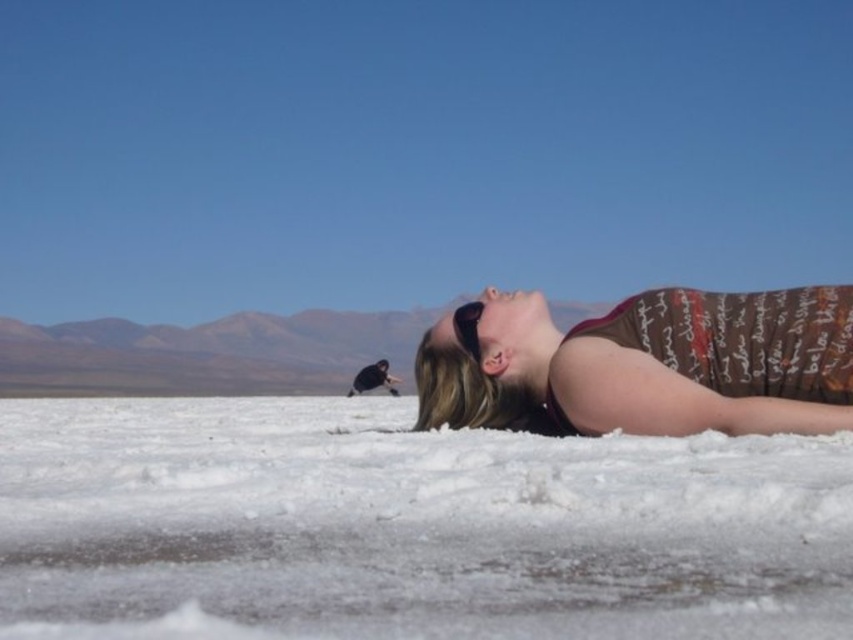
You are a photographer trying to capture the scene with a wide angle lens. You notice the white powdery snow at lower center and the brown printed tank top at center. Which object is positioned closer to the camera lens?

The white powdery snow at lower center is closer to the viewer than the brown printed tank top at center, so it will appear closer to the camera lens.

You are a photographer trying to capture a closeup of the brown printed fabric at lower right without the black matte sunglasses at upper center blocking the view. Is this possible based on their positions?

The brown printed fabric at lower right is in front of the black matte sunglasses at upper center, so the sunglasses will block the view of the fabric. You cannot capture a clear closeup of the brown printed fabric at lower right without the sunglasses obstructing it.